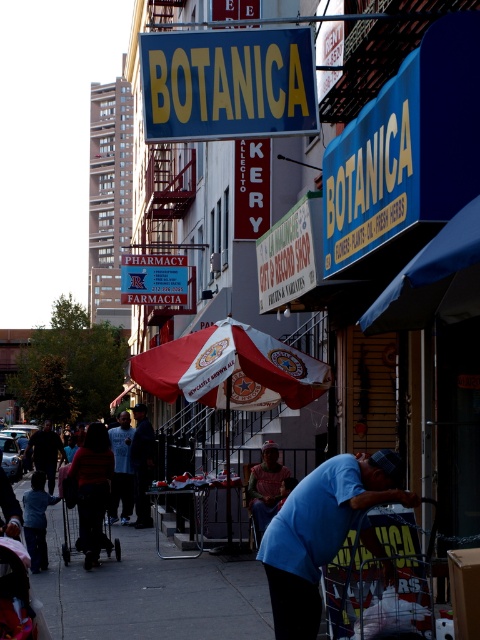
Is blue denim jeans at center shorter than dark blue shirt at center?

No.

Can you confirm if blue denim jeans at center is taller than dark blue shirt at center?

Yes, blue denim jeans at center is taller than dark blue shirt at center.

What do you see at coordinates (142, 464) in the screenshot?
I see `blue denim jeans at center` at bounding box center [142, 464].

Find the location of a particular element. The height and width of the screenshot is (640, 480). blue denim jeans at center is located at coordinates (142, 464).

In the scene shown: Can you confirm if blue fabric cart at lower center is positioned to the left of blue denim jeans at center?

Incorrect, blue fabric cart at lower center is not on the left side of blue denim jeans at center.

Is blue fabric cart at lower center bigger than blue denim jeans at center?

No.

Identify the location of blue fabric cart at lower center. The image size is (480, 640). (321, 532).

Who is shorter, light blue t-shirt at center or dark blue shirt at center?

dark blue shirt at center

Which is more to the right, light blue t-shirt at center or dark blue shirt at center?

Positioned to the right is light blue t-shirt at center.

Locate an element on the screen. Image resolution: width=480 pixels, height=640 pixels. light blue t-shirt at center is located at coordinates (121, 468).